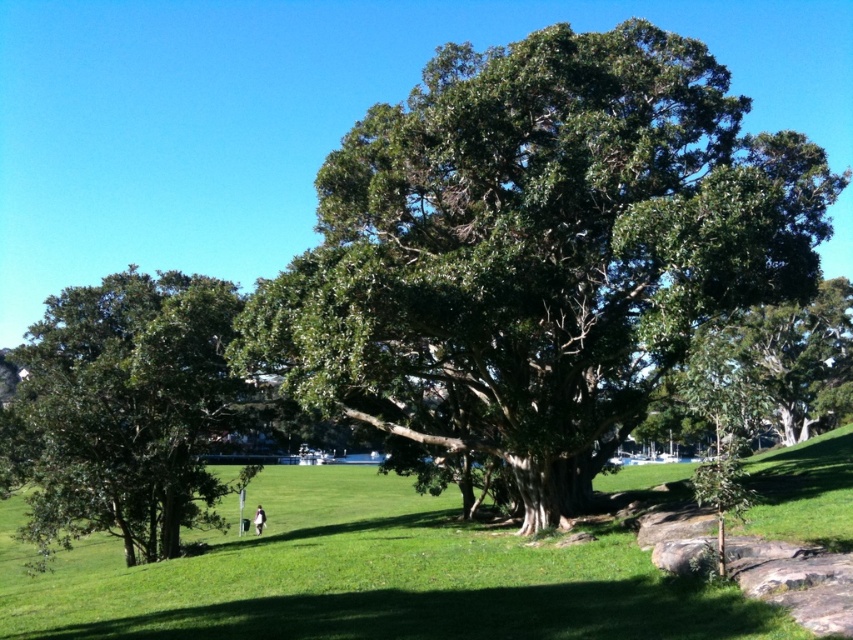
Question: Based on their relative distances, which object is nearer to the white fabric bag at lower center?

Choices:
 (A) green grassy at center
 (B) green glossy tree at left
 (C) green leafy oak tree at center

Answer: (B)

Question: Which of the following is the farthest from the observer?

Choices:
 (A) (67, 634)
 (B) (70, 531)
 (C) (323, 196)

Answer: (B)

Question: Does green leafy oak tree at center lie behind white fabric bag at lower center?

Choices:
 (A) yes
 (B) no

Answer: (B)

Question: Which object is the closest to the white fabric bag at lower center?

Choices:
 (A) green glossy tree at left
 (B) green leafy oak tree at center

Answer: (A)

Question: In this image, where is green leafy oak tree at center located relative to white fabric bag at lower center?

Choices:
 (A) right
 (B) left

Answer: (A)

Question: Where is green leafy oak tree at center located in relation to green grassy at center in the image?

Choices:
 (A) right
 (B) left

Answer: (A)